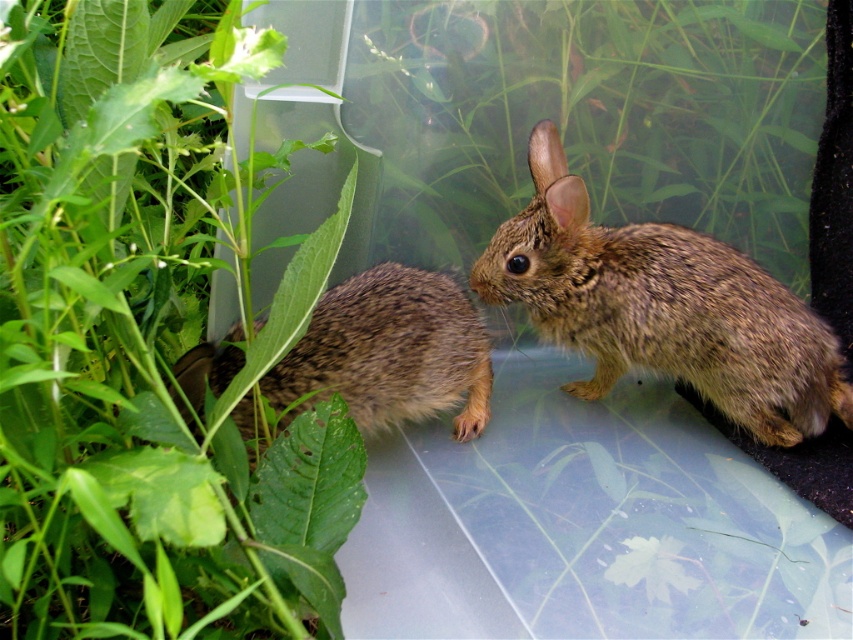
Can you confirm if brown fuzzy rabbit at center is bigger than brown fuzzy rabbit at left?

Yes, brown fuzzy rabbit at center is bigger than brown fuzzy rabbit at left.

Is point (503, 257) behind point (434, 314)?

Yes, point (503, 257) is farther from viewer.

Measure the distance between point [585,348] and camera.

The distance of point [585,348] from camera is 4.52 feet.

The width and height of the screenshot is (853, 640). I want to click on brown fuzzy rabbit at center, so click(662, 307).

Who is positioned more to the right, green leafy plant at left or brown fuzzy rabbit at left?

From the viewer's perspective, brown fuzzy rabbit at left appears more on the right side.

What do you see at coordinates (148, 339) in the screenshot?
I see `green leafy plant at left` at bounding box center [148, 339].

Who is more distant from viewer, (4, 156) or (413, 374)?

→ The point (413, 374) is behind.

Locate an element on the screen. This screenshot has width=853, height=640. green leafy plant at left is located at coordinates (148, 339).

Does green leafy plant at left have a smaller size compared to brown fuzzy rabbit at center?

No, green leafy plant at left is not smaller than brown fuzzy rabbit at center.

Can you confirm if green leafy plant at left is wider than brown fuzzy rabbit at center?

In fact, green leafy plant at left might be narrower than brown fuzzy rabbit at center.

Image resolution: width=853 pixels, height=640 pixels. What are the coordinates of `green leafy plant at left` in the screenshot? It's located at (148, 339).